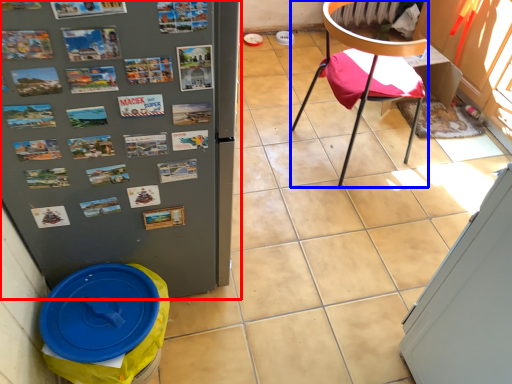
Question: Which object appears closest to the camera in this image, refrigerator (highlighted by a red box) or chair (highlighted by a blue box)?

Choices:
 (A) refrigerator
 (B) chair

Answer: (A)